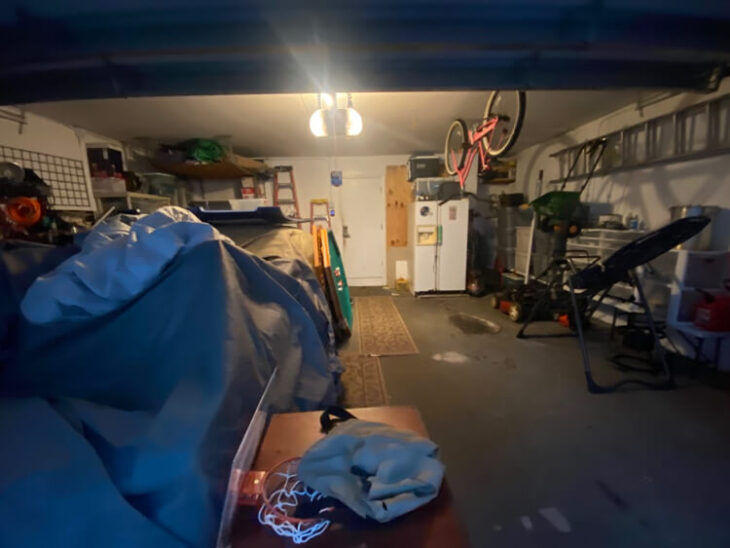
Where is `ladder`? ladder is located at coordinates (318, 215), (282, 189).